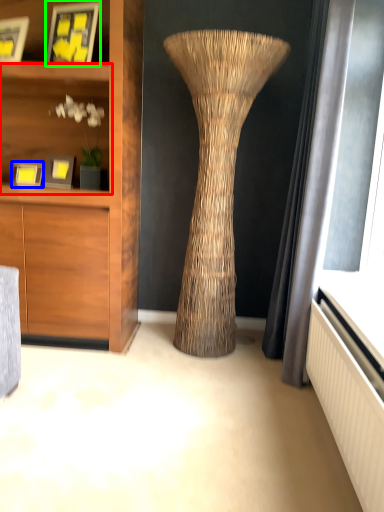
Question: Which is farther away from shelf (highlighted by a red box)? picture frame (highlighted by a blue box) or picture frame (highlighted by a green box)?

Choices:
 (A) picture frame
 (B) picture frame

Answer: (A)